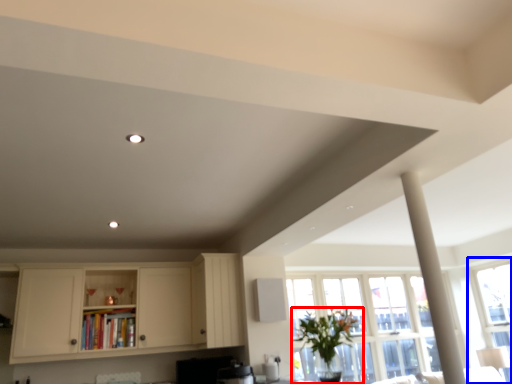
Question: Among these objects, which one is nearest to the camera, houseplant (highlighted by a red box) or window (highlighted by a blue box)?

Choices:
 (A) houseplant
 (B) window

Answer: (A)